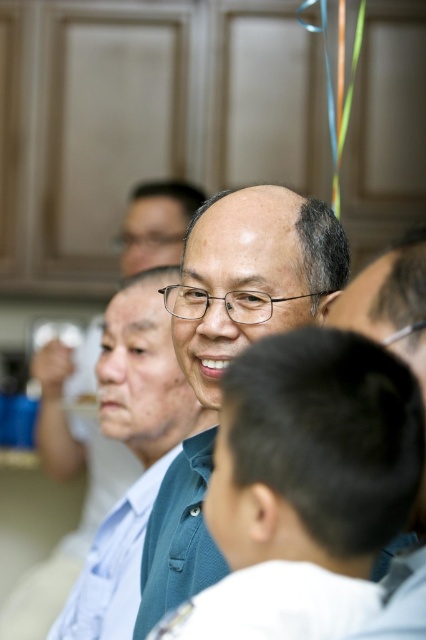
You are a photographer adjusting the camera focus. You notice the green matte shirt at center and the matte blue shirt at center in your viewfinder. Which of these two shirts should you focus on if you want to capture the taller one clearly?

The matte blue shirt at center is taller than the green matte shirt at center, so you should focus on the matte blue shirt at center to capture the taller one clearly.

You are a photographer adjusting your camera settings to focus on two points in the image. The first point is labeled as point (247, 248) and the second is point (137, 378). Which point should you focus on if you want to ensure the closest object is sharp?

Point (247, 248) is closer to the camera than point (137, 378), so you should focus on point (247, 248) to ensure the closest object is sharp.

You are a photographer adjusting the focus of your camera. You want to ensure both the green matte shirt at center and the matte blue shirt at center are in focus. Given that your camera has a depth of field that can cover 20 inches, will both shirts be in focus?

The green matte shirt at center is 20.37 inches from matte blue shirt at center. Since the distance between them exceeds the camera depth of field of 20 inches, the matte blue shirt at center may be slightly out of focus.